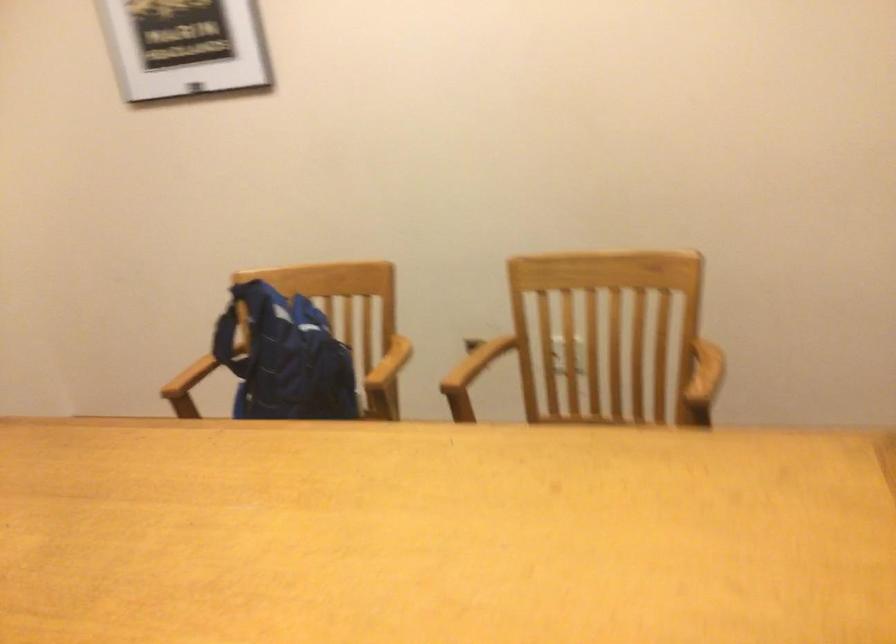
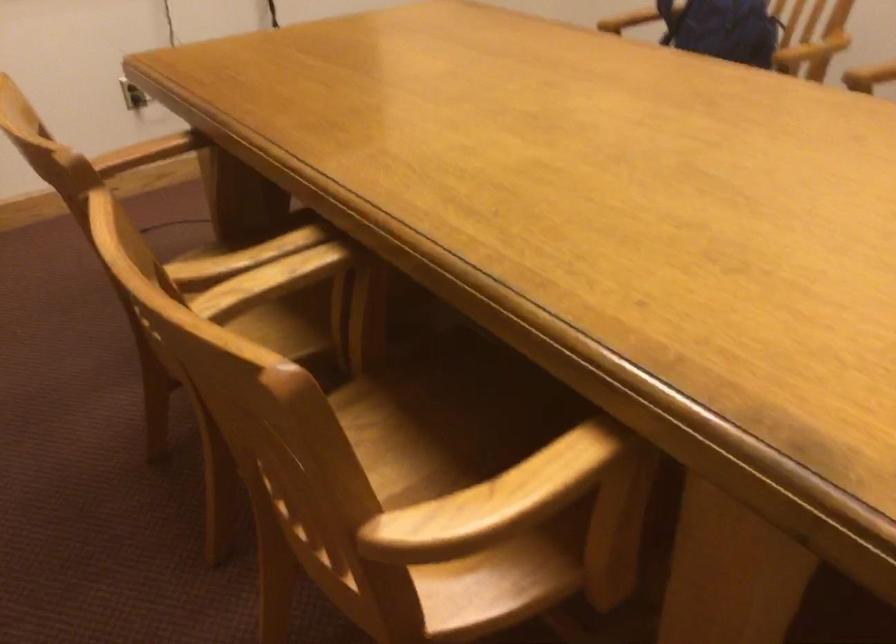
How did the camera likely rotate?

The rotation direction of the camera is left-down.